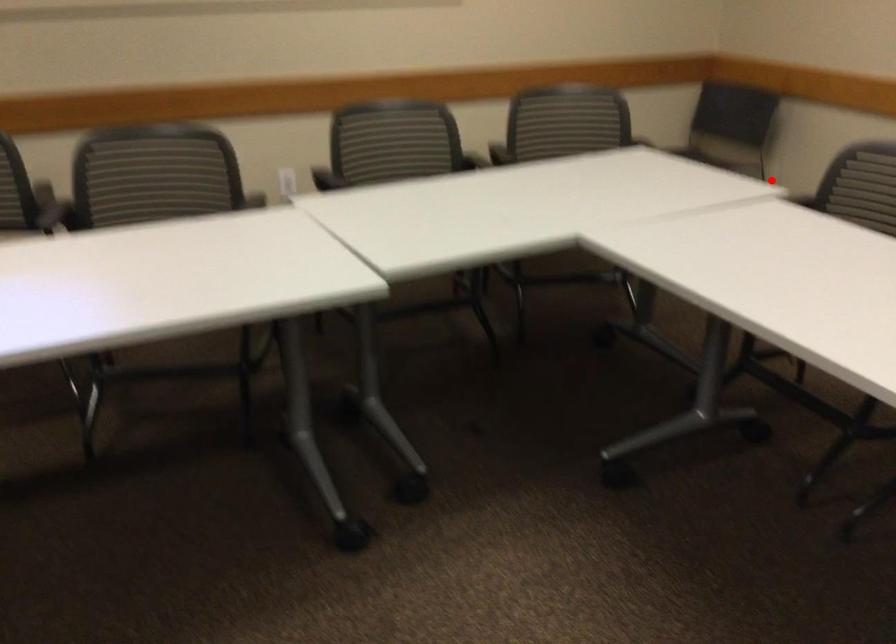
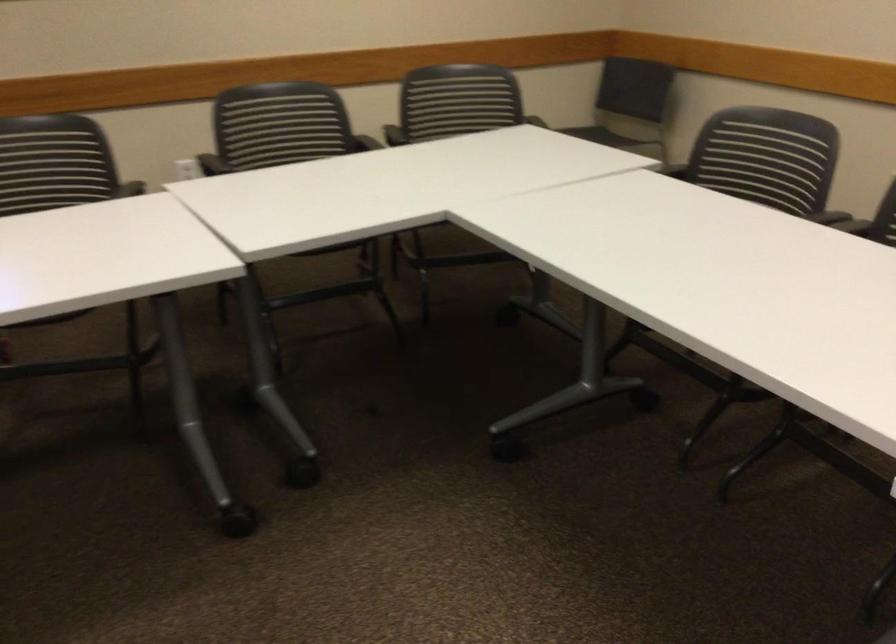
The point at the highlighted location is marked in the first image. Where is the corresponding point in the second image?

(660, 158)